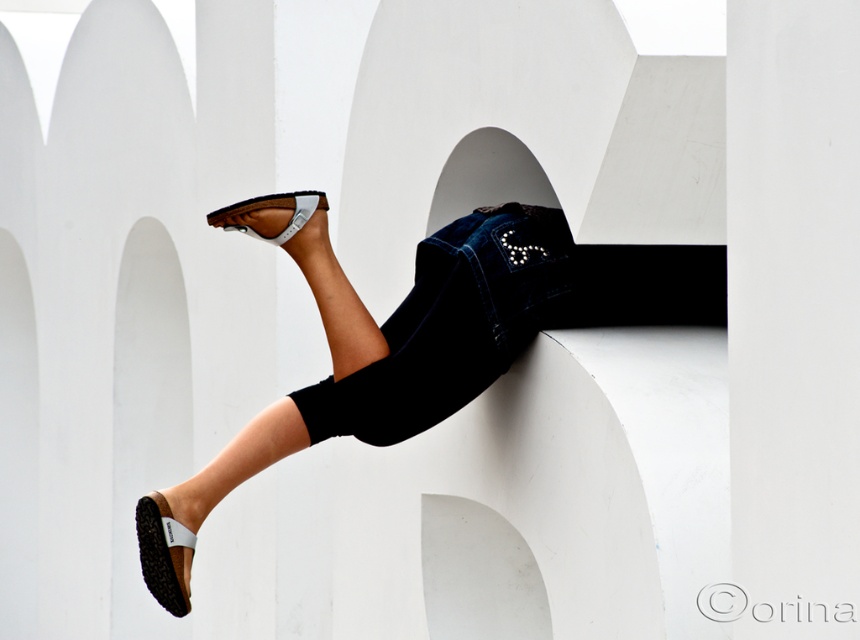
Question: Which object is the farthest from the black rubber sandal at lower left?

Choices:
 (A) denim jacket at center
 (B) brown leather sandal at upper center

Answer: (B)

Question: Which object appears farthest from the camera in this image?

Choices:
 (A) brown leather sandal at upper center
 (B) denim jacket at center
 (C) black rubber sandal at lower left
 (D) brown leather sandals at lower left

Answer: (A)

Question: Estimate the real-world distances between objects in this image. Which object is farther from the brown leather sandals at lower left?

Choices:
 (A) brown leather sandal at upper center
 (B) black rubber sandal at lower left

Answer: (B)

Question: From the image, what is the correct spatial relationship of denim jacket at center in relation to brown leather sandal at upper center?

Choices:
 (A) right
 (B) left

Answer: (A)

Question: Is black rubber sandal at lower left below brown leather sandal at upper center?

Choices:
 (A) no
 (B) yes

Answer: (B)

Question: Is brown leather sandals at lower left wider than denim jacket at center?

Choices:
 (A) yes
 (B) no

Answer: (A)